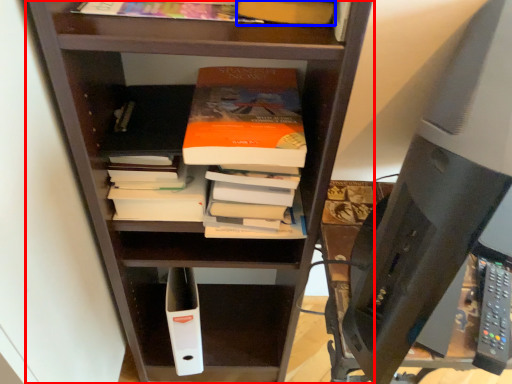
Question: Which object is closer to the camera taking this photo, shelf (highlighted by a red box) or book (highlighted by a blue box)?

Choices:
 (A) shelf
 (B) book

Answer: (A)